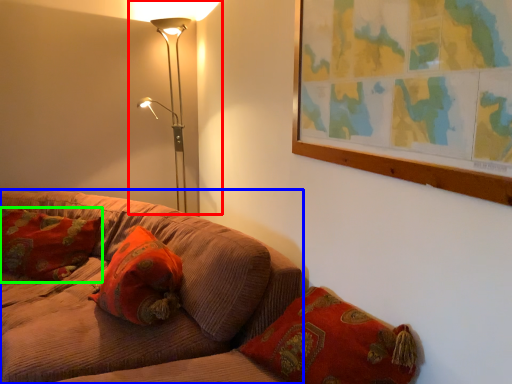
Question: Which object is the farthest from lamp (highlighted by a red box)? Choose among these: studio couch (highlighted by a blue box) or pillow (highlighted by a green box).

Choices:
 (A) studio couch
 (B) pillow

Answer: (A)